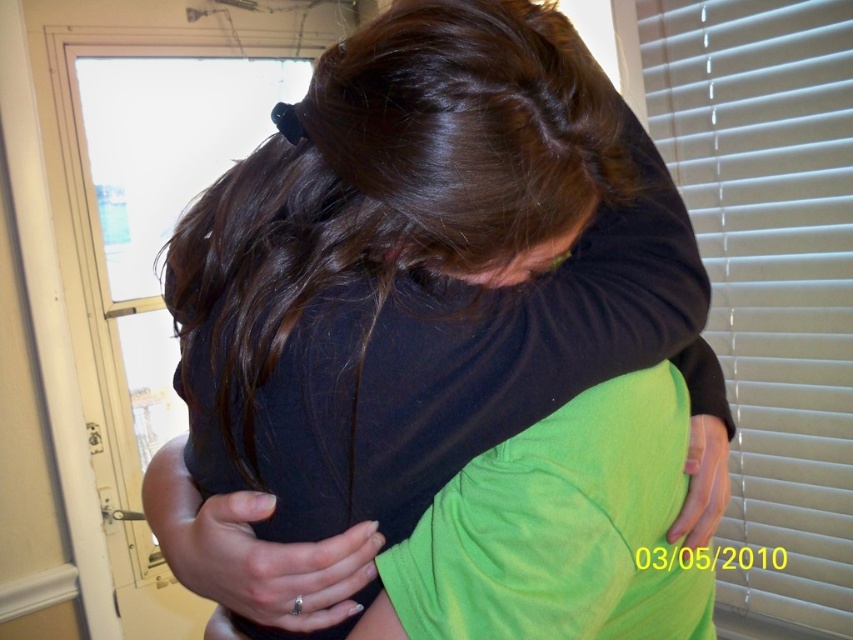
You are a photographer adjusting lighting in a room with a matte black shirt at center and white blinds at right. Which object should you focus on to ensure proper exposure since it takes up more space?

The matte black shirt at center should be focused on for proper exposure because it is larger in size than the white blinds at right.

You are standing at the point marked as point (480, 161) in the image. You want to take a photo of the two people hugging without moving. Can you do it from your current position?

Yes, because the point (480, 161) is 17.90 inches away from the camera, so you can take the photo from there without moving.